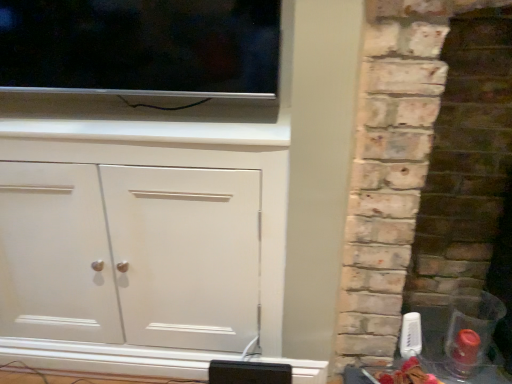
Question: From the image's perspective, is rustic stone fireplace at right on top of white matte cabinet at center?

Choices:
 (A) no
 (B) yes

Answer: (B)

Question: Is rustic stone fireplace at right positioned in front of white matte cabinet at center?

Choices:
 (A) no
 (B) yes

Answer: (B)

Question: Is rustic stone fireplace at right looking in the opposite direction of white matte cabinet at center?

Choices:
 (A) no
 (B) yes

Answer: (A)

Question: From the image's perspective, is rustic stone fireplace at right under white matte cabinet at center?

Choices:
 (A) no
 (B) yes

Answer: (A)

Question: Does rustic stone fireplace at right have a lesser width compared to white matte cabinet at center?

Choices:
 (A) yes
 (B) no

Answer: (B)

Question: Is rustic stone fireplace at right to the left of white matte cabinet at center from the viewer's perspective?

Choices:
 (A) yes
 (B) no

Answer: (B)

Question: Considering the relative positions of white matte cabinet at center and flat screen tv at upper left in the image provided, is white matte cabinet at center behind flat screen tv at upper left?

Choices:
 (A) no
 (B) yes

Answer: (B)

Question: Considering the relative sizes of white matte cabinet at center and flat screen tv at upper left in the image provided, is white matte cabinet at center taller than flat screen tv at upper left?

Choices:
 (A) yes
 (B) no

Answer: (A)

Question: Is white matte cabinet at center to the right of flat screen tv at upper left from the viewer's perspective?

Choices:
 (A) yes
 (B) no

Answer: (B)

Question: Is white matte cabinet at center to the left of flat screen tv at upper left from the viewer's perspective?

Choices:
 (A) yes
 (B) no

Answer: (A)

Question: Is white matte cabinet at center thinner than flat screen tv at upper left?

Choices:
 (A) no
 (B) yes

Answer: (A)

Question: Can you confirm if white matte cabinet at center is smaller than flat screen tv at upper left?

Choices:
 (A) no
 (B) yes

Answer: (A)

Question: Considering the relative sizes of flat screen tv at upper left and rustic stone fireplace at right in the image provided, is flat screen tv at upper left wider than rustic stone fireplace at right?

Choices:
 (A) yes
 (B) no

Answer: (B)